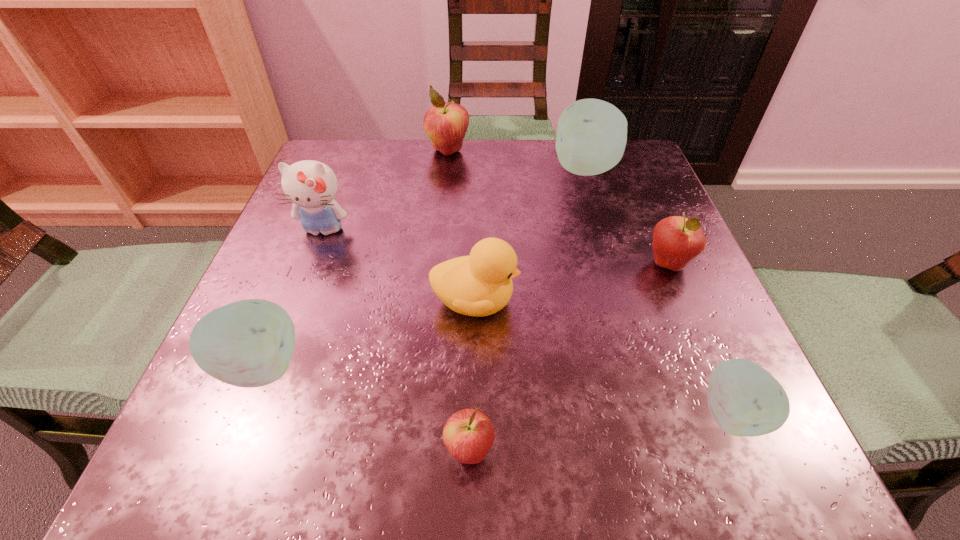
Locate an element on the screen. apple that is the third closest one to the second smallest red apple is located at coordinates (468, 435).

Identify which red apple is the nearest to the third farthest object. Please provide its 2D coordinates. Your answer should be formatted as a tuple, i.e. [(x, y)], where the tuple contains the x and y coordinates of a point satisfying the conditions above.

[(445, 123)]

The width and height of the screenshot is (960, 540). Find the location of `the second closest red apple to the duck`. the second closest red apple to the duck is located at coordinates (677, 240).

Image resolution: width=960 pixels, height=540 pixels. In order to click on white apple that is the second closest to the second biggest red apple in this screenshot , I will do `click(745, 400)`.

Select which white apple is the third closest to the farthest red apple. Please provide its 2D coordinates. Your answer should be formatted as a tuple, i.e. [(x, y)], where the tuple contains the x and y coordinates of a point satisfying the conditions above.

[(745, 400)]

The height and width of the screenshot is (540, 960). In order to click on free space that satisfies the following two spatial constraints: 1. on the back side of the smallest white apple; 2. on the left side of the nearest red apple in this screenshot , I will do `click(470, 414)`.

Find the location of `free space that satisfies the following two spatial constraints: 1. on the front-facing side of the smallest white apple; 2. on the left side of the duck`. free space that satisfies the following two spatial constraints: 1. on the front-facing side of the smallest white apple; 2. on the left side of the duck is located at coordinates tap(473, 414).

The height and width of the screenshot is (540, 960). What are the coordinates of `vacant space that satisfies the following two spatial constraints: 1. on the front-facing side of the rightmost red apple; 2. on the left side of the kitten` in the screenshot? It's located at (310, 264).

Locate an element on the screen. free space that satisfies the following two spatial constraints: 1. on the front side of the nearest red apple; 2. on the left side of the leftmost white apple is located at coordinates (227, 451).

At what (x,y) coordinates should I click in order to perform the action: click on vacant space that satisfies the following two spatial constraints: 1. on the front-facing side of the smallest white apple; 2. on the right side of the sixth nearest object. Please return your answer as a coordinate pair (x, y). The width and height of the screenshot is (960, 540). Looking at the image, I should click on (252, 414).